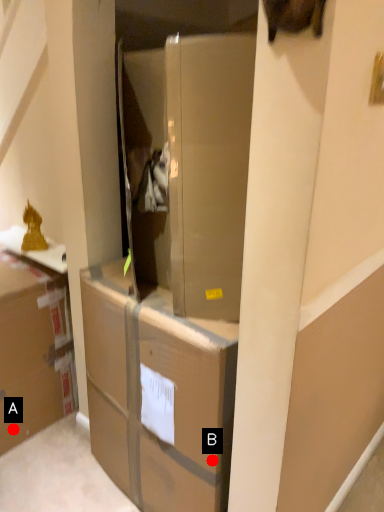
Question: Two points are circled on the image, labeled by A and B beside each circle. Which point is closer to the camera?

Choices:
 (A) A is closer
 (B) B is closer

Answer: (B)